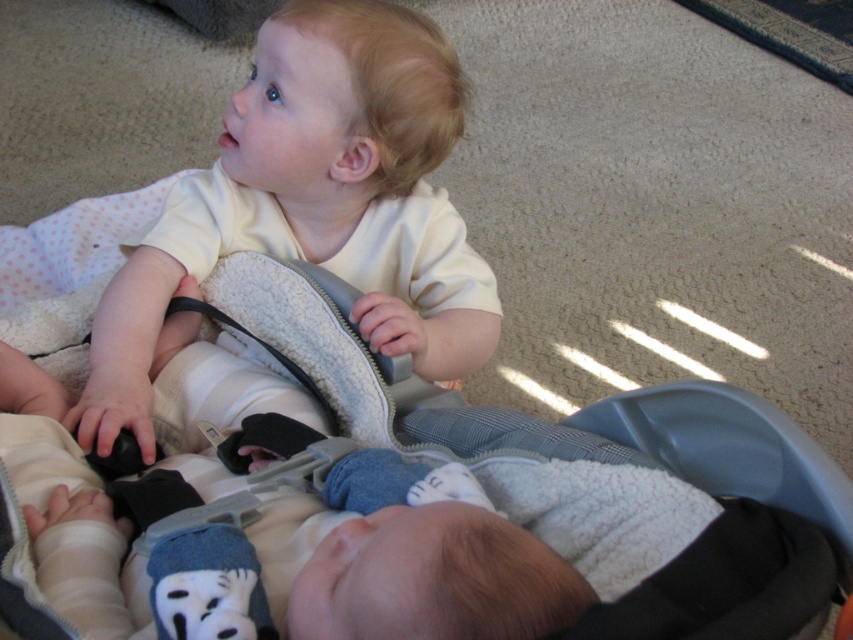
You are a parent trying to put your baby in the car seat. You have a matte white onesie at center and a gray fabric baby carriage at center in the room. Which item is closer to the baby?

The matte white onesie at center is closer to the baby since the gray fabric baby carriage at center is behind it.

You are a parent trying to choose between the matte white onesie at center and the gray fabric baby carriage at center for your baby. Which item is more suitable for a warm summer day?

The matte white onesie at center is thinner than the gray fabric baby carriage at center, making it more suitable for a warm summer day since thinner materials are better for keeping cool.